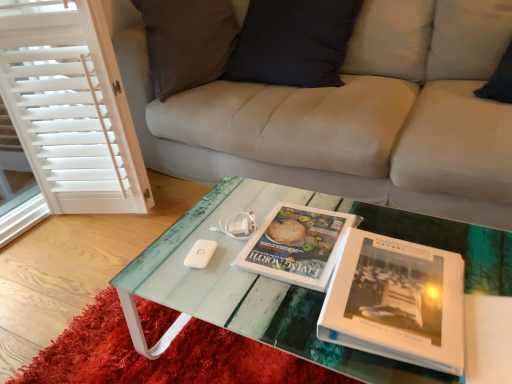
Question: From the image's perspective, would you say white matte game controller at center is positioned over translucent glass coffee table at center?

Choices:
 (A) no
 (B) yes

Answer: (A)

Question: Would you consider white matte game controller at center to be distant from translucent glass coffee table at center?

Choices:
 (A) no
 (B) yes

Answer: (A)

Question: Can you confirm if white matte game controller at center is thinner than translucent glass coffee table at center?

Choices:
 (A) no
 (B) yes

Answer: (B)

Question: Is white matte game controller at center positioned behind translucent glass coffee table at center?

Choices:
 (A) no
 (B) yes

Answer: (B)

Question: Is white matte game controller at center taller than translucent glass coffee table at center?

Choices:
 (A) yes
 (B) no

Answer: (B)

Question: From the image's perspective, is white matte game controller at center above or below translucent glass table at center?

Choices:
 (A) above
 (B) below

Answer: (A)

Question: Looking at the image, does white matte game controller at center seem bigger or smaller compared to translucent glass table at center?

Choices:
 (A) small
 (B) big

Answer: (A)

Question: Is point (243, 236) positioned closer to the camera than point (74, 331)?

Choices:
 (A) farther
 (B) closer

Answer: (B)

Question: Considering the relative positions of white matte game controller at center and translucent glass table at center in the image provided, is white matte game controller at center to the left or to the right of translucent glass table at center?

Choices:
 (A) left
 (B) right

Answer: (B)

Question: Visually, is matte white book at center, the second book in the front-to-back sequence, positioned to the left or to the right of translucent glass table at center?

Choices:
 (A) left
 (B) right

Answer: (B)

Question: Which is correct: matte white book at center, the second book in the front-to-back sequence, is inside translucent glass table at center, or outside of it?

Choices:
 (A) inside
 (B) outside

Answer: (B)

Question: Is point (275, 228) positioned closer to the camera than point (242, 365)?

Choices:
 (A) closer
 (B) farther

Answer: (A)

Question: Is matte white book at center, the first book positioned from the back, wider or thinner than translucent glass table at center?

Choices:
 (A) thin
 (B) wide

Answer: (A)

Question: Is matte white book at center, the first book positioned from the back, situated inside white matte game controller at center or outside?

Choices:
 (A) outside
 (B) inside

Answer: (A)

Question: Is matte white book at center, the second book in the front-to-back sequence, in front of or behind white matte game controller at center in the image?

Choices:
 (A) front
 (B) behind

Answer: (A)